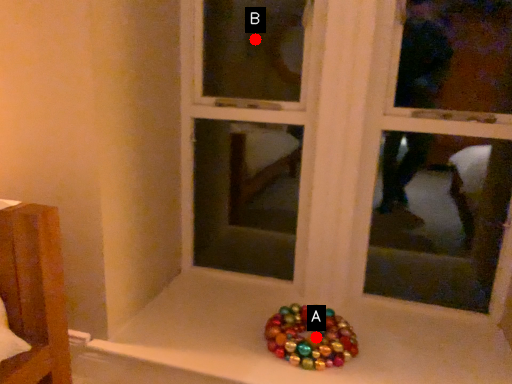
Question: Two points are circled on the image, labeled by A and B beside each circle. Among these points, which one is nearest to the camera?

Choices:
 (A) A is closer
 (B) B is closer

Answer: (A)